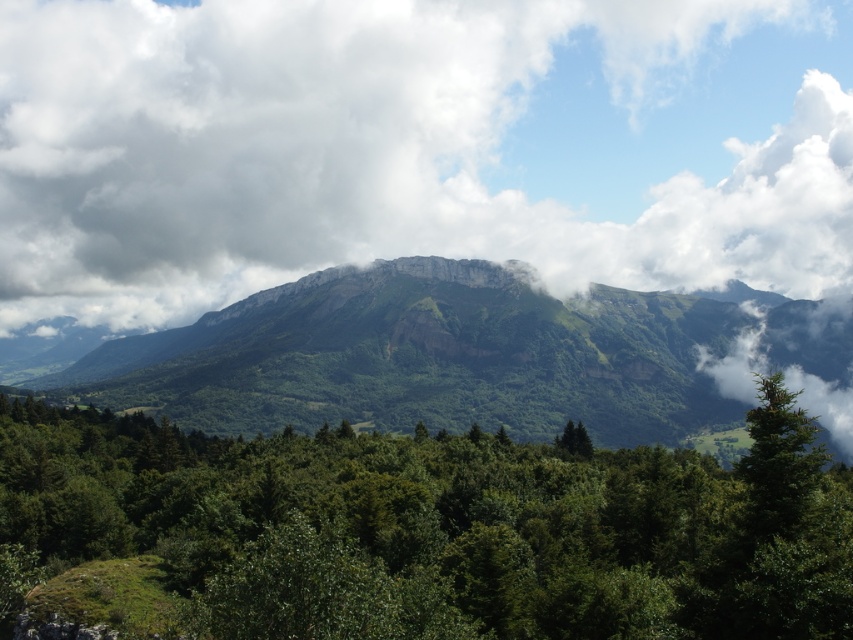
Question: Estimate the real-world distances between objects in this image. Which object is closer to the green matte tree at lower right?

Choices:
 (A) green textured mountain at center
 (B) green leafy tree at center
 (C) white fluffy cloud at upper center

Answer: (B)

Question: Is green textured mountain at center to the left of green matte tree at lower right from the viewer's perspective?

Choices:
 (A) yes
 (B) no

Answer: (A)

Question: Is green leafy tree at center to the right of green matte tree at lower right from the viewer's perspective?

Choices:
 (A) no
 (B) yes

Answer: (A)

Question: Is green leafy tree at center positioned in front of green textured mountain at center?

Choices:
 (A) no
 (B) yes

Answer: (B)

Question: Which object is the closest to the green textured mountain at center?

Choices:
 (A) green matte tree at lower right
 (B) white fluffy cloud at upper center
 (C) green leafy tree at center

Answer: (B)

Question: Estimate the real-world distances between objects in this image. Which object is closer to the white fluffy cloud at upper center?

Choices:
 (A) green textured mountain at center
 (B) green matte tree at lower right
 (C) green leafy tree at center

Answer: (A)